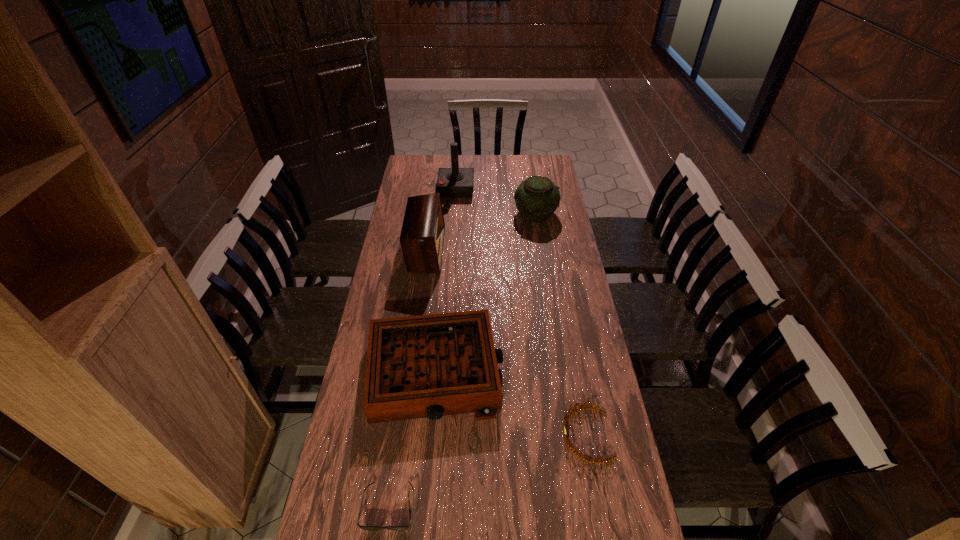
Find the location of a particular element. the closest object relative to the radio receiver is located at coordinates (452, 182).

Where is `object that can be found as the fifth closest to the pottery`? This screenshot has width=960, height=540. object that can be found as the fifth closest to the pottery is located at coordinates (406, 527).

The height and width of the screenshot is (540, 960). In order to click on vacant area in the image that satisfies the following two spatial constraints: 1. on the front-facing side of the radio receiver; 2. on the front-facing side of the shortest object in this screenshot , I will do `click(392, 506)`.

The width and height of the screenshot is (960, 540). What are the coordinates of `vacant region that satisfies the following two spatial constraints: 1. on the rectangular base of the pottery; 2. on the left side of the tallest object` in the screenshot? It's located at (454, 213).

Locate an element on the screen. The image size is (960, 540). blank area in the image that satisfies the following two spatial constraints: 1. on the back side of the pottery; 2. on the rectangular base of the tallest object is located at coordinates [532, 188].

Image resolution: width=960 pixels, height=540 pixels. Find the location of `free point that satisfies the following two spatial constraints: 1. on the front-facing side of the tiara; 2. on the front-facing side of the sunglasses`. free point that satisfies the following two spatial constraints: 1. on the front-facing side of the tiara; 2. on the front-facing side of the sunglasses is located at coordinates (598, 506).

Where is `vacant space that satisfies the following two spatial constraints: 1. on the back side of the pottery; 2. on the rectangular base of the farthest object`? vacant space that satisfies the following two spatial constraints: 1. on the back side of the pottery; 2. on the rectangular base of the farthest object is located at coordinates (532, 188).